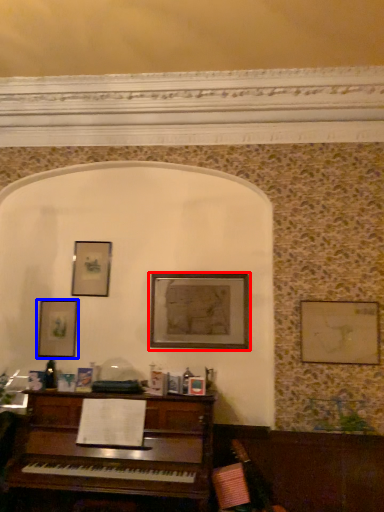
Question: Which object is further to the camera taking this photo, picture frame (highlighted by a red box) or picture frame (highlighted by a blue box)?

Choices:
 (A) picture frame
 (B) picture frame

Answer: (B)